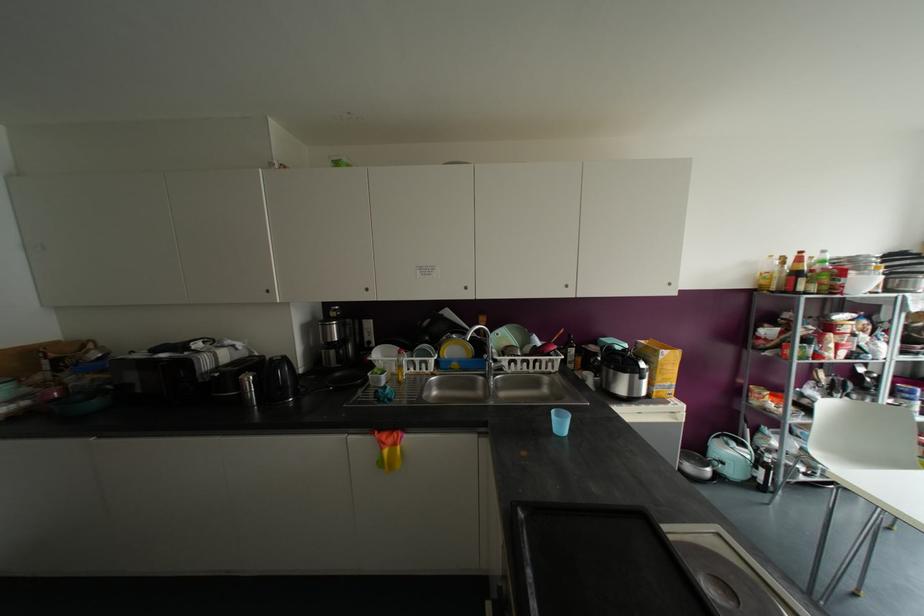
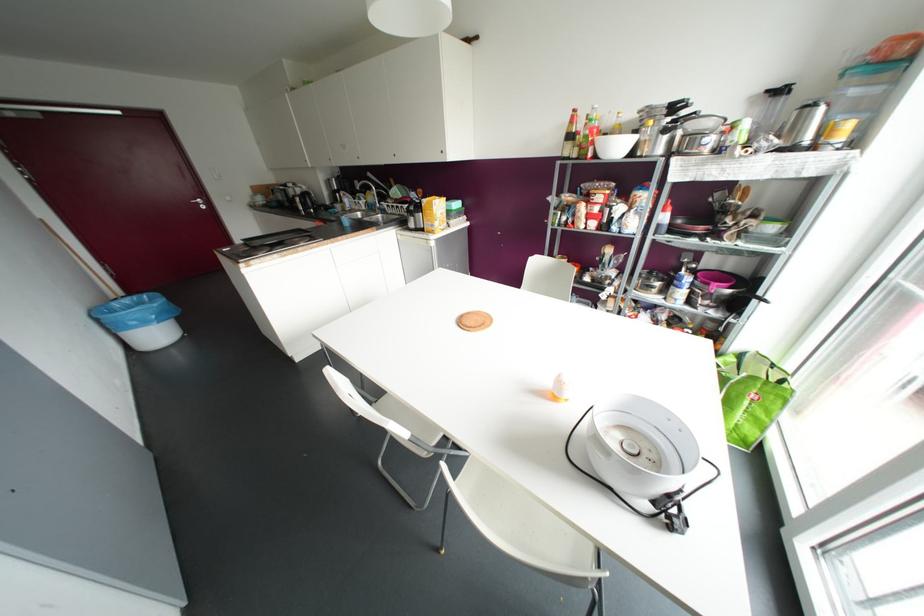
Where in the second image is the point corresponding to point (660, 357) from the first image?

(421, 204)